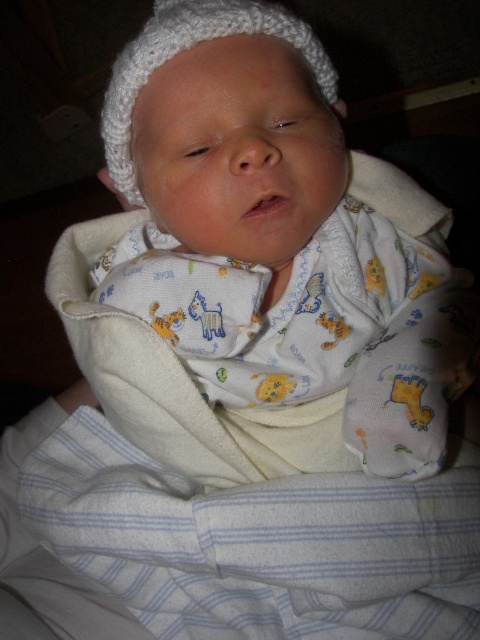
Which is behind, point (367, 570) or point (168, 54)?

The point (367, 570) is more distant.

Does white striped blanket at lower left have a larger size compared to white knitted hat at upper center?

Yes.

Between point (267, 580) and point (120, 90), which one is positioned behind?

The point (267, 580) is more distant.

Find the location of a particular element. The width and height of the screenshot is (480, 640). white striped blanket at lower left is located at coordinates (257, 544).